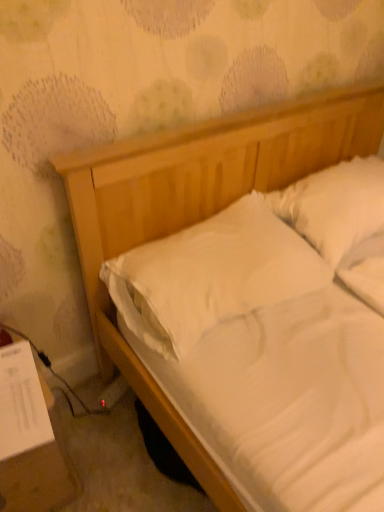
Question: Is the depth of white soft pillow at center, which ranks as the 2th pillow in right-to-left order, greater than that of white paper at lower left?

Choices:
 (A) yes
 (B) no

Answer: (A)

Question: Would you say white soft pillow at center, which appears as the first pillow when viewed from the left, is outside white paper at lower left?

Choices:
 (A) yes
 (B) no

Answer: (A)

Question: From a real-world perspective, is white soft pillow at center, which ranks as the 2th pillow in right-to-left order, positioned over white paper at lower left based on gravity?

Choices:
 (A) yes
 (B) no

Answer: (A)

Question: Is white soft pillow at center, which appears as the first pillow when viewed from the left, closer to camera compared to white paper at lower left?

Choices:
 (A) no
 (B) yes

Answer: (A)

Question: Is white paper at lower left a part of white soft pillow at center, which appears as the first pillow when viewed from the left?

Choices:
 (A) no
 (B) yes

Answer: (A)

Question: Considering the relative sizes of white soft pillow at center, which ranks as the 2th pillow in right-to-left order, and white paper at lower left in the image provided, is white soft pillow at center, which ranks as the 2th pillow in right-to-left order, bigger than white paper at lower left?

Choices:
 (A) yes
 (B) no

Answer: (A)

Question: Can you confirm if white soft pillow at center, which ranks as the 2th pillow in right-to-left order, is thinner than white soft pillow at upper right, the 2th pillow in the left-to-right sequence?

Choices:
 (A) yes
 (B) no

Answer: (B)

Question: From the image's perspective, is white soft pillow at center, which ranks as the 2th pillow in right-to-left order, located above white soft pillow at upper right, which is counted as the first pillow, starting from the right?

Choices:
 (A) yes
 (B) no

Answer: (B)

Question: Is white soft pillow at upper right, which is counted as the first pillow, starting from the right, a part of white soft pillow at center, which appears as the first pillow when viewed from the left?

Choices:
 (A) yes
 (B) no

Answer: (B)

Question: Does white soft pillow at center, which appears as the first pillow when viewed from the left, appear on the left side of white soft pillow at upper right, which is counted as the first pillow, starting from the right?

Choices:
 (A) yes
 (B) no

Answer: (A)

Question: From a real-world perspective, is white soft pillow at center, which ranks as the 2th pillow in right-to-left order, on top of white soft pillow at upper right, which is counted as the first pillow, starting from the right?

Choices:
 (A) no
 (B) yes

Answer: (A)

Question: Does white soft pillow at center, which appears as the first pillow when viewed from the left, have a larger size compared to white soft pillow at upper right, the 2th pillow in the left-to-right sequence?

Choices:
 (A) no
 (B) yes

Answer: (B)

Question: Is white paper at lower left oriented away from white soft pillow at center, which ranks as the 2th pillow in right-to-left order?

Choices:
 (A) no
 (B) yes

Answer: (A)